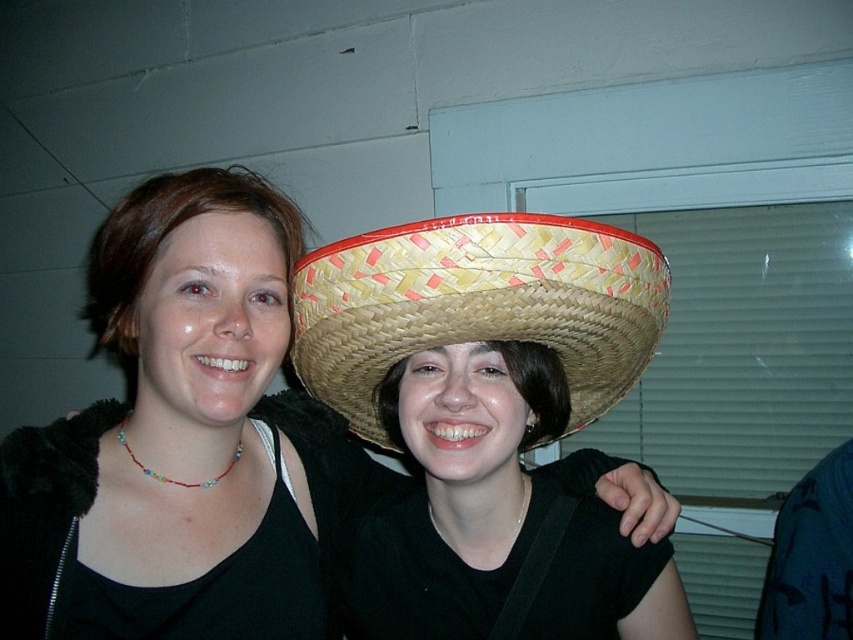
Is matte black tank top at center to the left of woven straw sombrero at center from the viewer's perspective?

Yes, matte black tank top at center is to the left of woven straw sombrero at center.

Between matte black tank top at center and woven straw sombrero at center, which one is positioned higher?

woven straw sombrero at center is higher up.

The image size is (853, 640). In order to click on matte black tank top at center in this screenshot , I will do `click(186, 442)`.

At what (x,y) coordinates should I click in order to perform the action: click on matte black tank top at center. Please return your answer as a coordinate pair (x, y). Looking at the image, I should click on (186, 442).